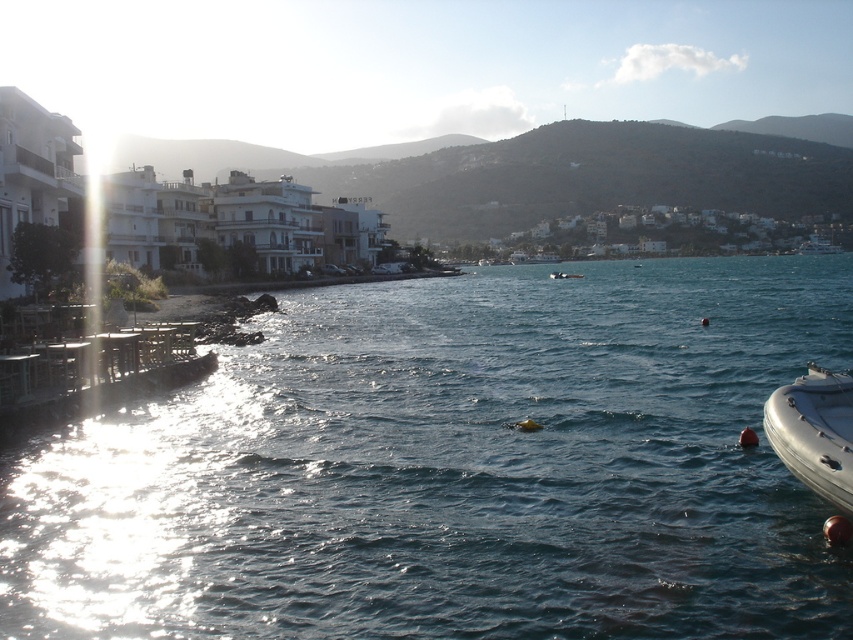
Is point (264, 461) farther from viewer compared to point (554, 275)?

No, (264, 461) is closer to viewer.

Identify the location of clear blue water at center. The height and width of the screenshot is (640, 853). (456, 468).

Is silver metallic dinghy at lower right thinner than white rubber boat at center?

Yes, silver metallic dinghy at lower right is thinner than white rubber boat at center.

Is point (845, 387) more distant than point (550, 276)?

No, (845, 387) is in front of (550, 276).

The height and width of the screenshot is (640, 853). In order to click on silver metallic dinghy at lower right in this screenshot , I will do `click(815, 432)`.

Between clear blue water at center and silver metallic dinghy at lower right, which one appears on the left side from the viewer's perspective?

silver metallic dinghy at lower right

Who is more distant from viewer, (297, 611) or (804, 465)?

Point (804, 465)

Between point (183, 467) and point (837, 432), which one is positioned behind?

Point (183, 467)

Locate an element on the screen. The width and height of the screenshot is (853, 640). clear blue water at center is located at coordinates (456, 468).